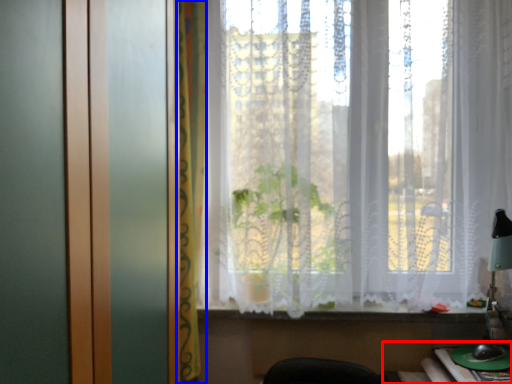
Question: Which of the following is the farthest to the observer, table (highlighted by a red box) or curtain (highlighted by a blue box)?

Choices:
 (A) table
 (B) curtain

Answer: (B)